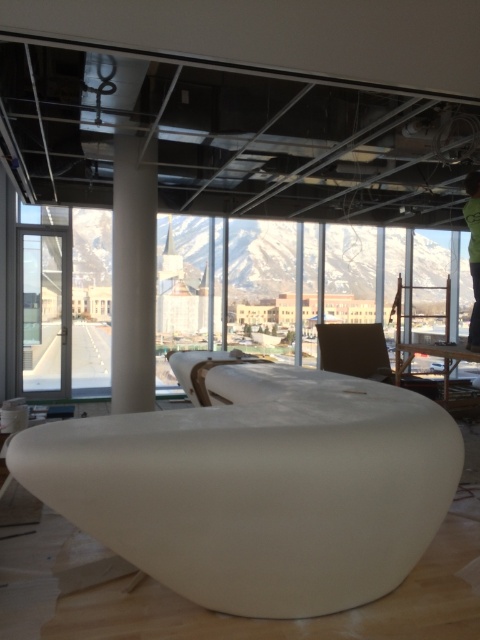
Between point (253, 572) and point (134, 301), which one is positioned behind?

The point (134, 301) is behind.

Is point (396, 582) positioned after point (156, 164)?

No, it is in front of (156, 164).

Identify the location of white matte/soft furniture at center. The image size is (480, 640). (256, 484).

Is white glossy table at center in front of green fabric person at center?

No, white glossy table at center is further to the viewer.

Looking at this image, who is more distant from viewer, (x=451, y=381) or (x=479, y=221)?

The point (x=451, y=381) is more distant.

Which is in front, point (428, 394) or point (469, 253)?

Point (469, 253) is more forward.

Identify the location of white glossy table at center. The height and width of the screenshot is (640, 480). (440, 380).

Which is more to the right, white smooth column at center or white glossy table at center?

From the viewer's perspective, white glossy table at center appears more on the right side.

Does white smooth column at center appear over white glossy table at center?

Yes.

Is point (131, 365) behind point (453, 365)?

No, it is not.

Identify the location of white smooth column at center. The height and width of the screenshot is (640, 480). (132, 273).